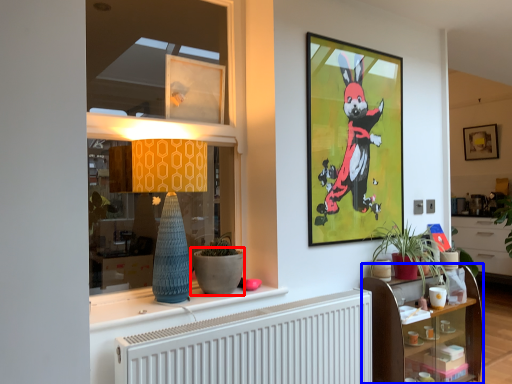
Question: Which of the following is the closest to the observer, flowerpot (highlighted by a red box) or shelf (highlighted by a blue box)?

Choices:
 (A) flowerpot
 (B) shelf

Answer: (A)